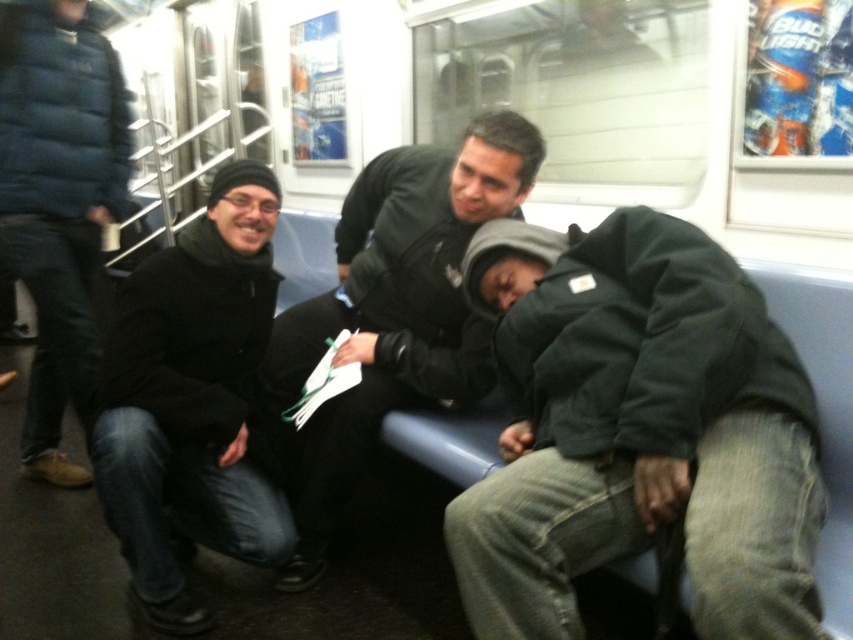
You are standing in the subway car and want to reach the point marked as point (142, 314). If your arm can extend 5 feet, can you reach that point without moving?

The distance between you and point (142, 314) is 5.84 feet, which is longer than your arm extension of 5 feet. Therefore, you cannot reach it without moving.

You are a passenger in the subway car and want to sit next to the dark green jacket at lower right. Based on their position at point 0.675, 0.749, where should you look to find them?

The dark green jacket at lower right is located at the coordinates (637, 432), so you should look towards the lower right section of the subway car to find them.

You are a photographer standing in the subway car and want to take a photo of both the dark green jacket at lower right and the dark blue puffer jacket at left. Which jacket should you focus on first to ensure both are in clear focus?

Since the dark green jacket at lower right is closer to the viewer than the dark blue puffer jacket at left, you should focus on the dark green jacket at lower right first to ensure both are in clear focus.